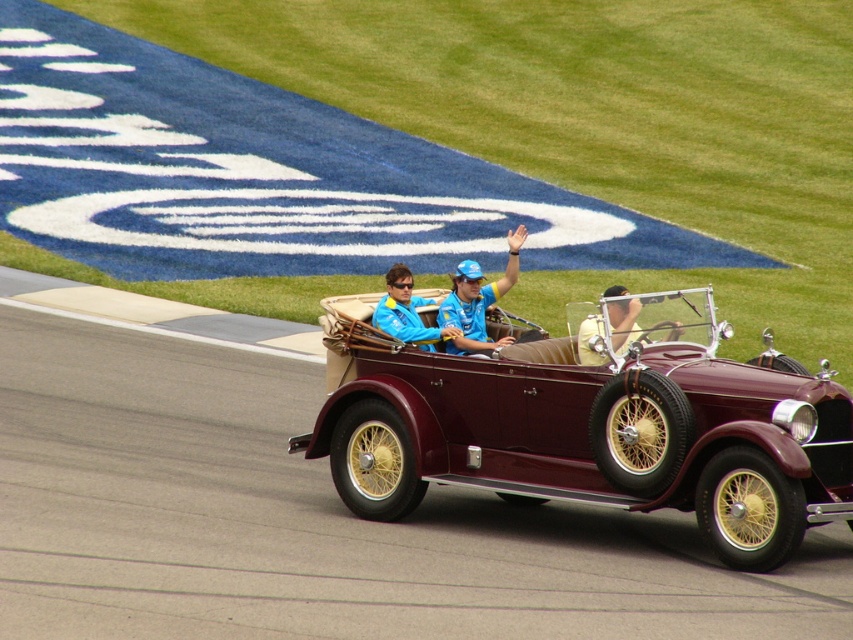
Consider the image. Between blue fabric shirt at center and matte blue jacket at center, which one has less height?

Standing shorter between the two is blue fabric shirt at center.

Which is below, blue fabric shirt at center or matte blue jacket at center?

blue fabric shirt at center is below.

Is point (482, 330) closer to camera compared to point (389, 292)?

No, (482, 330) is further to viewer.

Locate an element on the screen. The width and height of the screenshot is (853, 640). blue fabric shirt at center is located at coordinates (477, 300).

Which is more to the left, maroon leather convertible at center or yellow fabric shirt at center?

maroon leather convertible at center

Can you confirm if maroon leather convertible at center is wider than yellow fabric shirt at center?

Yes, maroon leather convertible at center is wider than yellow fabric shirt at center.

Locate an element on the screen. This screenshot has height=640, width=853. maroon leather convertible at center is located at coordinates (596, 426).

Is point (461, 273) farther from camera compared to point (635, 323)?

Yes, point (461, 273) is farther from viewer.

Who is lower down, blue fabric shirt at center or yellow fabric shirt at center?

Positioned lower is yellow fabric shirt at center.

Does point (488, 304) come behind point (613, 321)?

Yes, it is behind point (613, 321).

Identify the location of blue fabric shirt at center. This screenshot has height=640, width=853. (477, 300).